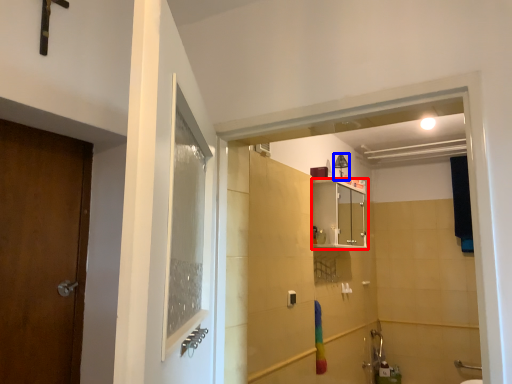
Question: Which object is closer to the camera taking this photo, cabinetry (highlighted by a red box) or light fixture (highlighted by a blue box)?

Choices:
 (A) cabinetry
 (B) light fixture

Answer: (A)